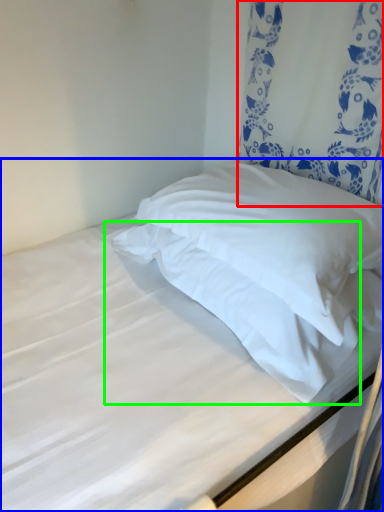
Question: Which is farther away from curtain (highlighted by a red box)? bed (highlighted by a blue box) or pillow (highlighted by a green box)?

Choices:
 (A) bed
 (B) pillow

Answer: (B)